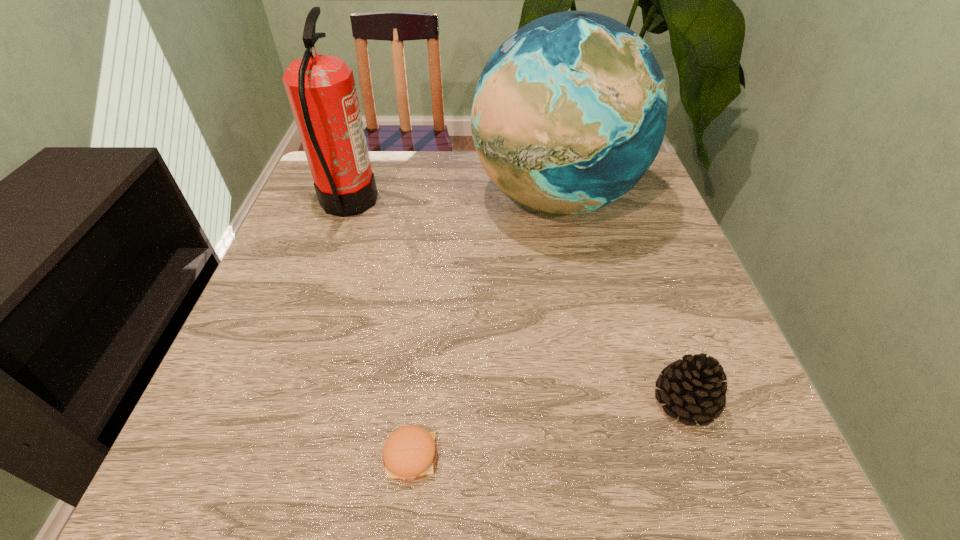
This screenshot has width=960, height=540. I want to click on vacant space at the near edge of the desktop, so click(665, 437).

Find the location of a particular element. This screenshot has width=960, height=540. vacant space at the left edge of the desktop is located at coordinates (249, 389).

Where is `vacant space at the right edge of the desktop`? vacant space at the right edge of the desktop is located at coordinates (691, 430).

This screenshot has height=540, width=960. What are the coordinates of `vacant space in between the third tallest object and the patty` in the screenshot? It's located at (548, 428).

Image resolution: width=960 pixels, height=540 pixels. What are the coordinates of `empty location between the globe and the leftmost object` in the screenshot? It's located at (451, 200).

You are a GUI agent. You are given a task and a screenshot of the screen. Output one action in this format:
    pyautogui.click(x=<x>, y=<y>)
    Task: Click on the vacant space in between the third tallest object and the second object from left to right
    The width and height of the screenshot is (960, 540).
    Given the screenshot: What is the action you would take?
    pyautogui.click(x=548, y=428)

Where is `free point between the globe and the fire extinguisher`? The height and width of the screenshot is (540, 960). free point between the globe and the fire extinguisher is located at coordinates (451, 200).

At what (x,y) coordinates should I click in order to perform the action: click on vacant space in between the pinecone and the leftmost object. Please return your answer as a coordinate pair (x, y). This screenshot has height=540, width=960. Looking at the image, I should click on (516, 302).

I want to click on free area in between the third object from right to left and the pinecone, so click(x=548, y=428).

The height and width of the screenshot is (540, 960). Find the location of `vacant region between the globe and the fire extinguisher`. vacant region between the globe and the fire extinguisher is located at coordinates (451, 200).